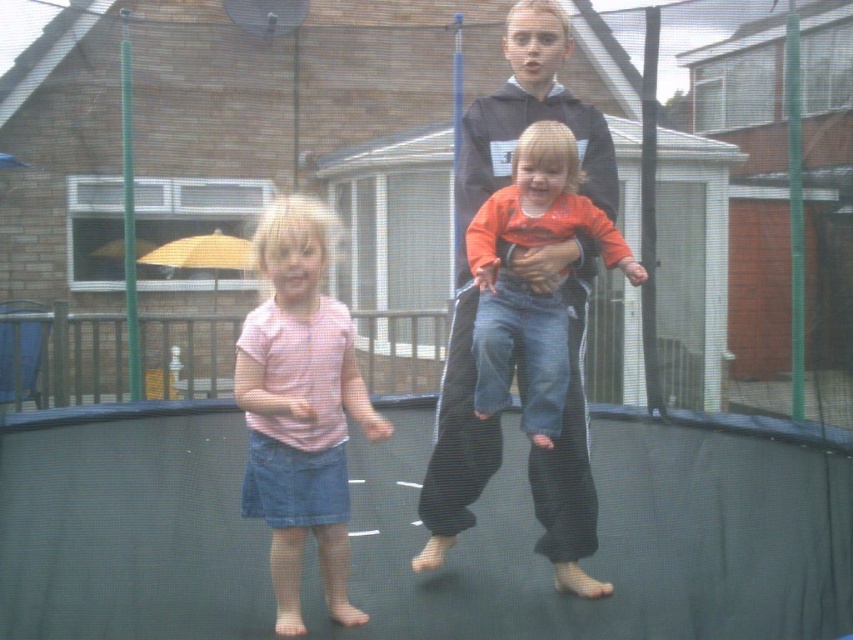
Question: Which point is closer to the camera taking this photo?

Choices:
 (A) (274, 627)
 (B) (578, 220)
 (C) (567, 102)

Answer: (A)

Question: Which point is closer to the camera taking this photo?

Choices:
 (A) (283, 627)
 (B) (554, 394)
 (C) (552, 458)

Answer: (A)

Question: Can you confirm if black hoodie at center is positioned below orange cotton shirt at center?

Choices:
 (A) yes
 (B) no

Answer: (A)

Question: Is black hoodie at center thinner than orange cotton shirt at center?

Choices:
 (A) no
 (B) yes

Answer: (A)

Question: Can you confirm if pink cotton shirt at center is bigger than orange cotton shirt at center?

Choices:
 (A) yes
 (B) no

Answer: (A)

Question: Which object is positioned closest to the black hoodie at center?

Choices:
 (A) orange cotton shirt at center
 (B) pink cotton shirt at center

Answer: (A)